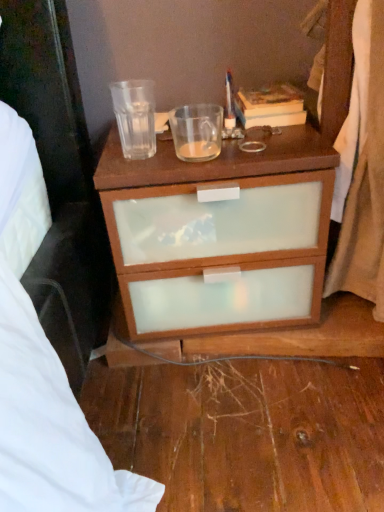
The height and width of the screenshot is (512, 384). What are the coordinates of `vacant area that is situated to the right of transparent glass at upper center, the 1th coffee cup from the left` in the screenshot? It's located at (221, 138).